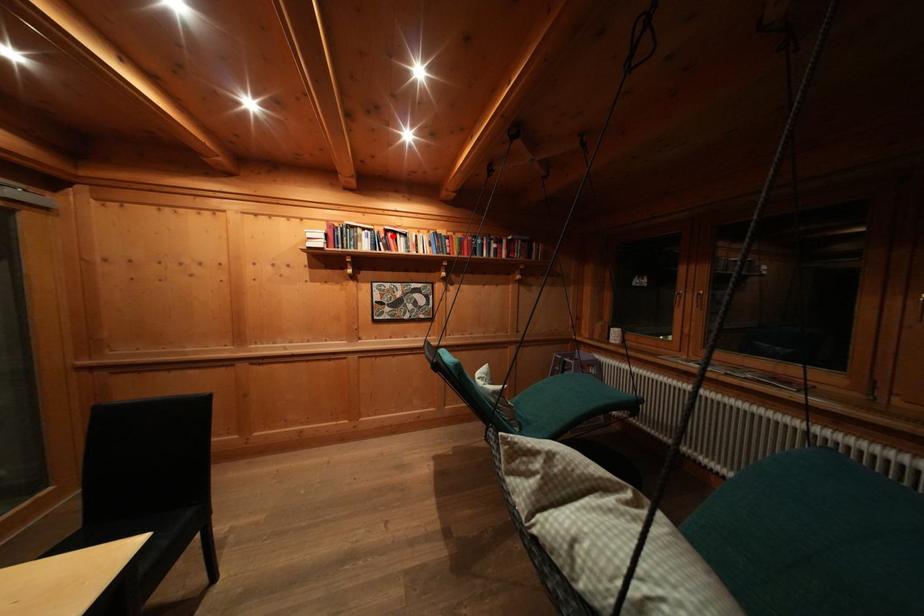
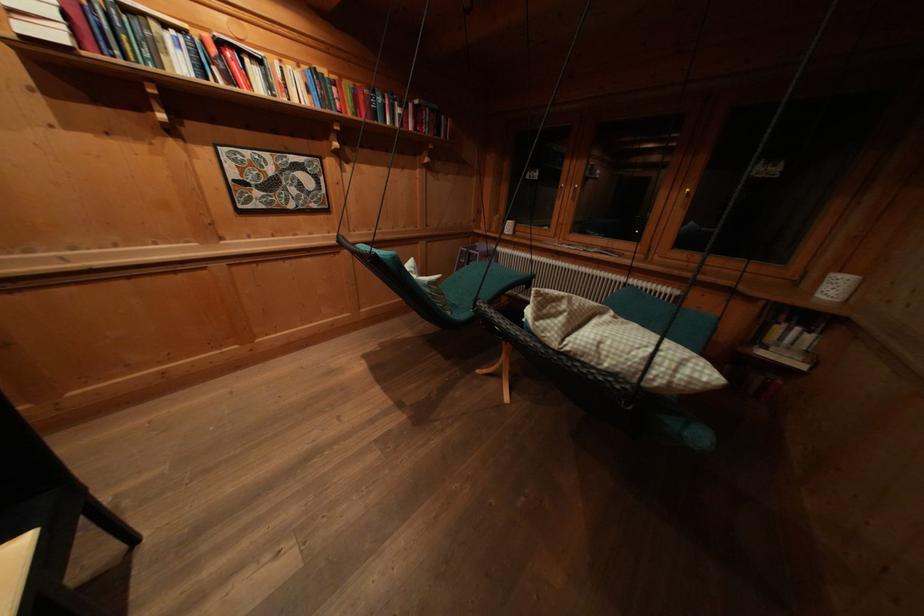
The point at the highlighted location is marked in the first image. Where is the corresponding point in the second image?

(225, 47)